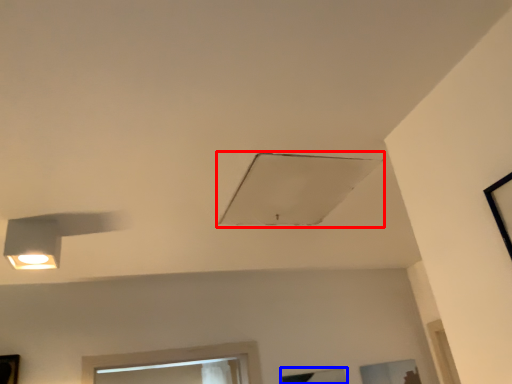
Question: Which point is closer to the camera, exhaust hood (highlighted by a red box) or window (highlighted by a blue box)?

Choices:
 (A) exhaust hood
 (B) window

Answer: (A)